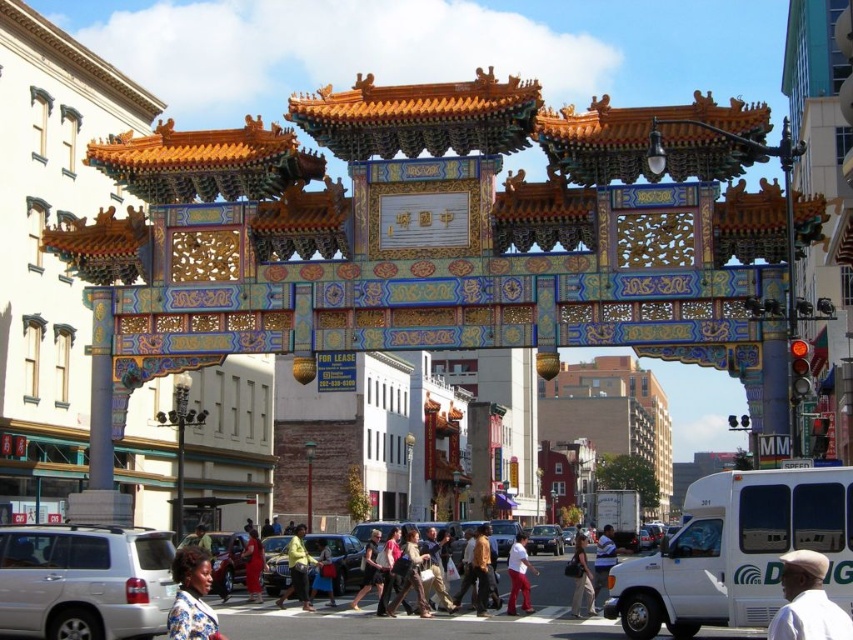
Question: Does matte red shirt at center appear under yellow fabric bag at center?

Choices:
 (A) yes
 (B) no

Answer: (B)

Question: Which of the following is the closest to the observer?

Choices:
 (A) yellow fabric bag at center
 (B) blue striped shirt at center
 (C) matte white shirt at center

Answer: (C)

Question: Which object is farther from the camera taking this photo?

Choices:
 (A) metallic silver sedan at center
 (B) light brown leather hat at lower right
 (C) blue floral dress at lower left

Answer: (A)

Question: Which object is closer to the camera taking this photo?

Choices:
 (A) blue striped shirt at center
 (B) yellow fabric bag at center
 (C) silver metallic suv at lower left
 (D) matte red shirt at center

Answer: (C)

Question: Is blue floral dress at lower left to the left of metallic silver car at center from the viewer's perspective?

Choices:
 (A) no
 (B) yes

Answer: (B)

Question: Can you confirm if light brown leather hat at lower right is smaller than metallic silver car at center?

Choices:
 (A) yes
 (B) no

Answer: (A)